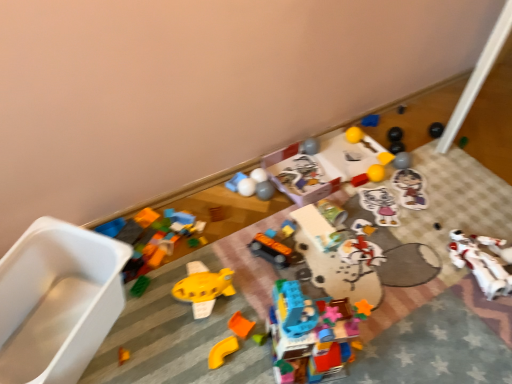
The height and width of the screenshot is (384, 512). Find the location of `vacant area that lies between white plastic robot at lower right, which appears as the seventeenth toy when viewed from the left, and matte black car at center, the tenth toy positioned from the right`. vacant area that lies between white plastic robot at lower right, which appears as the seventeenth toy when viewed from the left, and matte black car at center, the tenth toy positioned from the right is located at coordinates (379, 265).